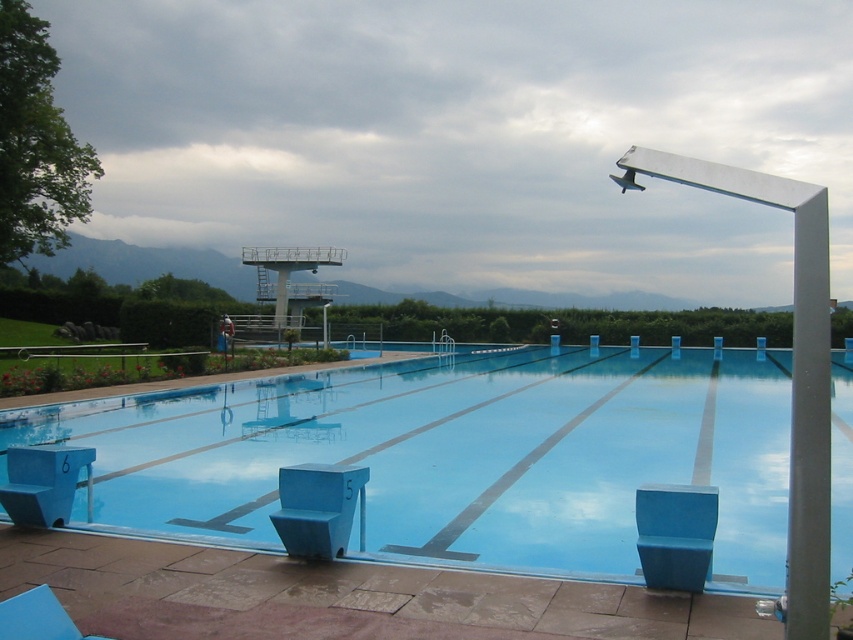
Question: Which object is the farthest from the blue smooth diving board at upper center?

Choices:
 (A) blue plastic chair at lower center
 (B) blue plastic chair at lower left

Answer: (A)

Question: Does blue smooth diving board at upper center have a smaller size compared to blue plastic chair at lower left?

Choices:
 (A) yes
 (B) no

Answer: (B)

Question: Among these points, which one is farthest from the camera?

Choices:
 (A) (247, 413)
 (B) (314, 554)
 (C) (22, 484)

Answer: (A)

Question: Does blue plastic chair at lower center lie in front of blue plastic chair at lower left?

Choices:
 (A) yes
 (B) no

Answer: (A)

Question: Which point appears farthest from the camera in this image?

Choices:
 (A) tap(260, 390)
 (B) tap(47, 476)

Answer: (A)

Question: Does blue plastic chair at lower center have a greater width compared to blue plastic chair at lower left?

Choices:
 (A) no
 (B) yes

Answer: (A)